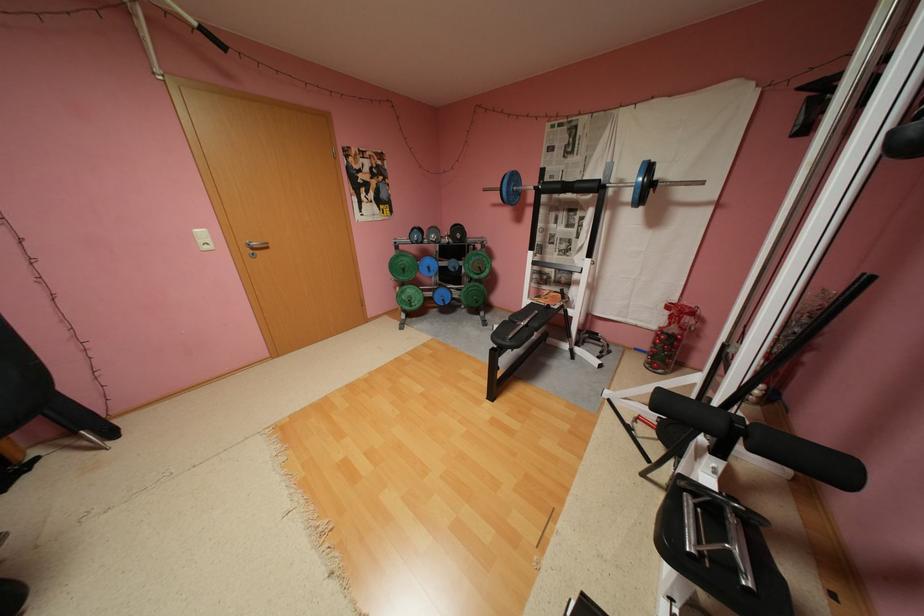
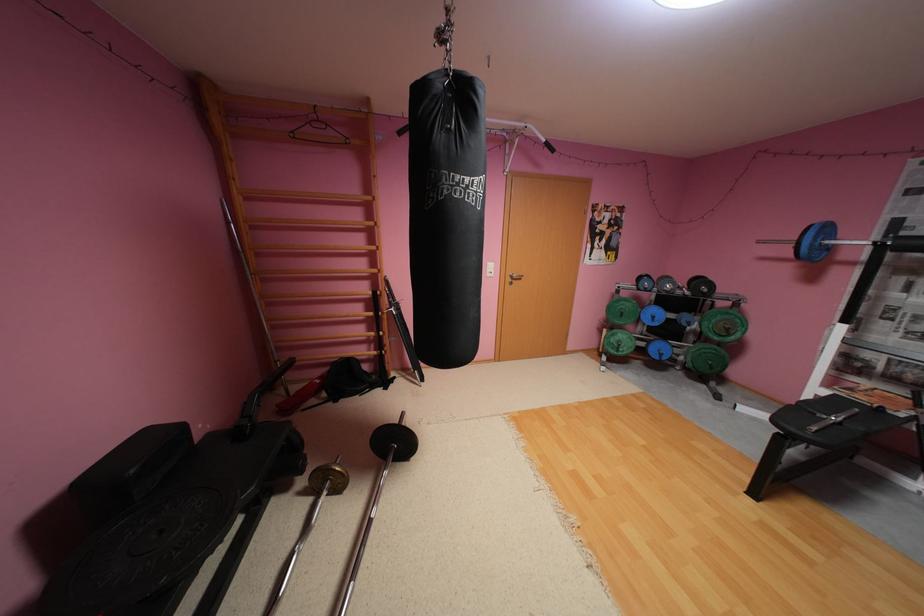
The point at (491, 272) is marked in the first image. Where is the corresponding point in the second image?

(737, 334)